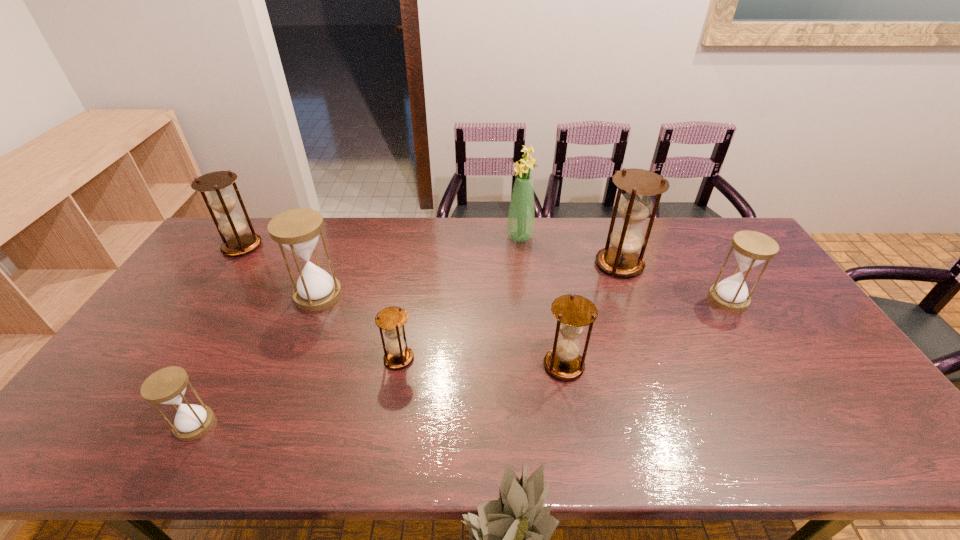
Where is `green bouquet`? green bouquet is located at coordinates (521, 217).

Where is `the biggest brown hourglass`? the biggest brown hourglass is located at coordinates (621, 259).

Identify the location of the second hourglass from right to left. (621, 259).

Where is `the leftmost hourglass`? The width and height of the screenshot is (960, 540). the leftmost hourglass is located at coordinates (233, 226).

I want to click on the second biggest brown hourglass, so click(x=233, y=226).

This screenshot has width=960, height=540. In order to click on the third object from left to right in this screenshot , I will do `click(298, 230)`.

Where is `the second white hourglass from right to left`? This screenshot has height=540, width=960. the second white hourglass from right to left is located at coordinates (298, 230).

I want to click on the fifth hourglass from left to right, so click(x=573, y=312).

The image size is (960, 540). In order to click on the third brown hourglass from left to right in this screenshot , I will do `click(573, 312)`.

You are a GUI agent. You are given a task and a screenshot of the screen. Output one action in this format:
    pyautogui.click(x=<x>, y=<y>)
    Task: Click on the rightmost hourglass
    
    Given the screenshot: What is the action you would take?
    pyautogui.click(x=751, y=248)